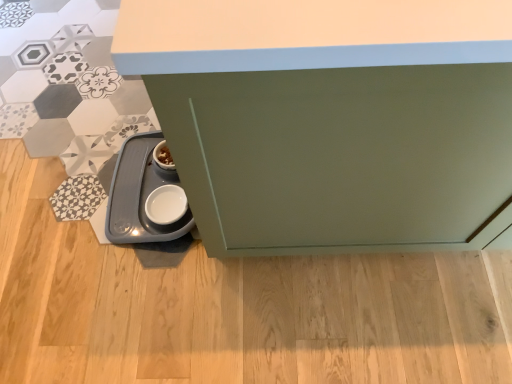
Question: Does satin green cabinet at lower left touch white glossy pet feeder at lower left?

Choices:
 (A) no
 (B) yes

Answer: (A)

Question: From the image's perspective, is satin green cabinet at lower left beneath white glossy pet feeder at lower left?

Choices:
 (A) yes
 (B) no

Answer: (B)

Question: Is satin green cabinet at lower left further to the viewer compared to white glossy pet feeder at lower left?

Choices:
 (A) no
 (B) yes

Answer: (A)

Question: Could you tell me if satin green cabinet at lower left is turned towards white glossy pet feeder at lower left?

Choices:
 (A) yes
 (B) no

Answer: (B)

Question: Would you say satin green cabinet at lower left is outside white glossy pet feeder at lower left?

Choices:
 (A) no
 (B) yes

Answer: (B)

Question: Can you confirm if satin green cabinet at lower left is thinner than white glossy pet feeder at lower left?

Choices:
 (A) no
 (B) yes

Answer: (A)

Question: Does white glossy pet feeder at lower left have a lesser height compared to satin green cabinet at lower left?

Choices:
 (A) yes
 (B) no

Answer: (A)

Question: Considering the relative positions of white glossy pet feeder at lower left and satin green cabinet at lower left in the image provided, is white glossy pet feeder at lower left to the right of satin green cabinet at lower left from the viewer's perspective?

Choices:
 (A) no
 (B) yes

Answer: (A)

Question: Does white glossy pet feeder at lower left touch satin green cabinet at lower left?

Choices:
 (A) yes
 (B) no

Answer: (B)

Question: Is white glossy pet feeder at lower left wider than satin green cabinet at lower left?

Choices:
 (A) yes
 (B) no

Answer: (B)

Question: Can you confirm if white glossy pet feeder at lower left is thinner than satin green cabinet at lower left?

Choices:
 (A) no
 (B) yes

Answer: (B)

Question: Is satin green cabinet at lower left inside white glossy pet feeder at lower left?

Choices:
 (A) no
 (B) yes

Answer: (A)

Question: Would you say satin green cabinet at lower left is to the left or to the right of white glossy pet feeder at lower left in the picture?

Choices:
 (A) left
 (B) right

Answer: (B)